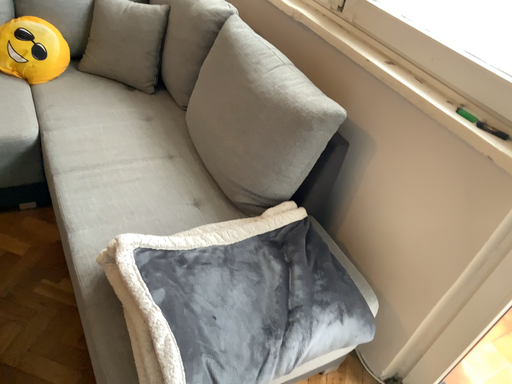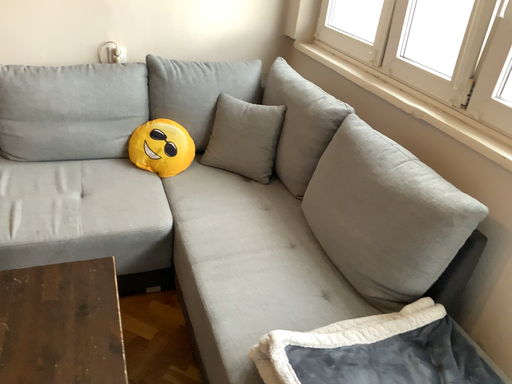
Question: How did the camera likely rotate when shooting the video?

Choices:
 (A) rotated right
 (B) rotated left

Answer: (B)